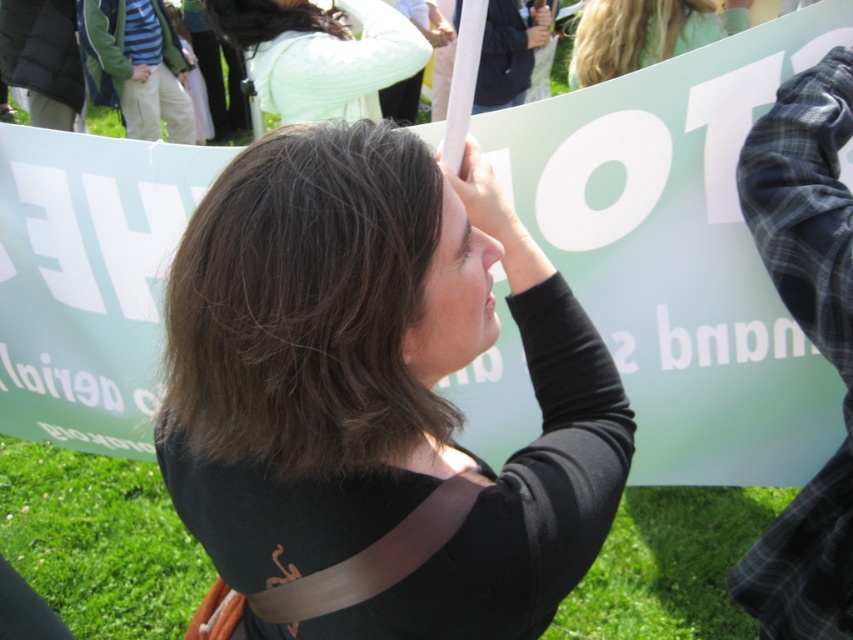
You are a photographer trying to capture a clear shot of both the black matte shirt at center and the white knitted sweater at upper center in the scene. Based on their positions, which one should you adjust your camera to focus on first to ensure both are in the frame?

The black matte shirt at center is positioned on the right side of the white knitted sweater at upper center, so you should focus on the white knitted sweater at upper center first to ensure both are included in the frame.

Based on the scene description, which object is positioned higher up in the image between the black matte shirt at center and the blonde hair at upper center?

The blonde hair at upper center is positioned higher up in the image than the black matte shirt at center.